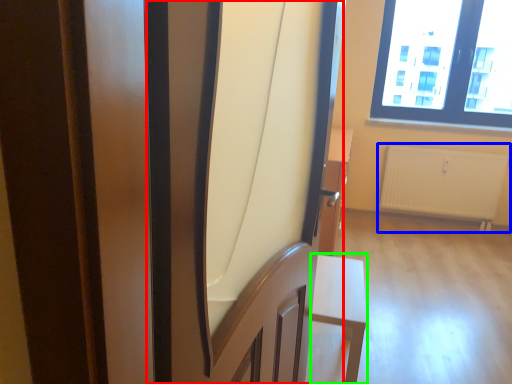
Question: Estimate the real-world distances between objects in this image. Which object is farther from screen door (highlighted by a red box), radiator (highlighted by a blue box) or furniture (highlighted by a green box)?

Choices:
 (A) radiator
 (B) furniture

Answer: (A)